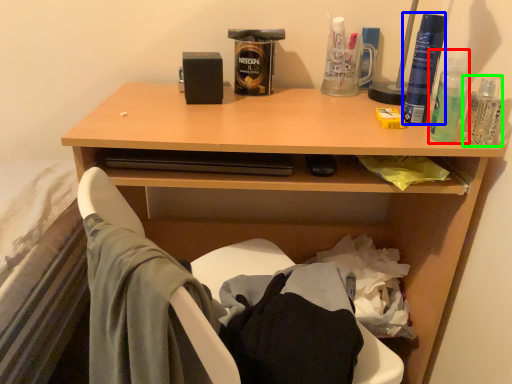
Question: Based on their relative distances, which object is farther from mouthwash (highlighted by a red box)? Choose from bottle (highlighted by a blue box) and bottle (highlighted by a green box).

Choices:
 (A) bottle
 (B) bottle

Answer: (B)